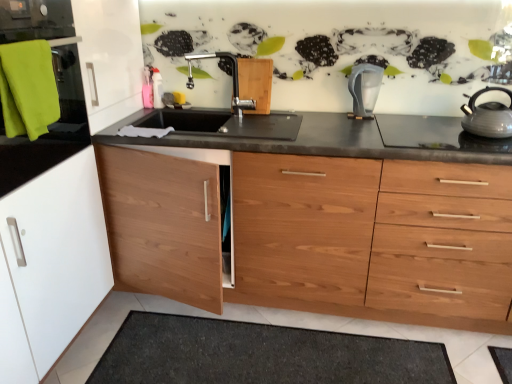
This screenshot has height=384, width=512. What do you see at coordinates (224, 124) in the screenshot?
I see `black matte sink at center` at bounding box center [224, 124].

Find the location of a particular element. black matte sink at center is located at coordinates (224, 124).

What do you see at coordinates (435, 134) in the screenshot? I see `shiny silver gas stove at right` at bounding box center [435, 134].

Measure the distance between point (401, 123) and camera.

Point (401, 123) is 6.67 feet away from camera.

Identify the location of black matte sink at center. (224, 124).

From a real-world perspective, which is physically below, dark gray textured bath mat at lower center or shiny silver gas stove at right?

dark gray textured bath mat at lower center.

Is dark gray textured bath mat at lower center next to shiny silver gas stove at right and touching it?

There is a gap between dark gray textured bath mat at lower center and shiny silver gas stove at right.

Which of these two, dark gray textured bath mat at lower center or shiny silver gas stove at right, stands taller?

dark gray textured bath mat at lower center.

Find the location of a particular element. bath mat located underneath the shiny silver gas stove at right (from a real-world perspective) is located at coordinates (260, 355).

Which of these two, matte silver faucet at center or shiny silver gas stove at right, is smaller?

With smaller size is shiny silver gas stove at right.

Who is shorter, matte silver faucet at center or shiny silver gas stove at right?

Standing shorter between the two is shiny silver gas stove at right.

From the picture: How different are the orientations of matte silver faucet at center and shiny silver gas stove at right in degrees?

They differ by 1.05 degrees in their facing directions.

Is matte silver faucet at center located outside shiny silver gas stove at right?

matte silver faucet at center lies outside shiny silver gas stove at right's area.

Considering the relative sizes of shiny silver gas stove at right and matte silver faucet at center in the image provided, is shiny silver gas stove at right wider than matte silver faucet at center?

Indeed, shiny silver gas stove at right has a greater width compared to matte silver faucet at center.

Which point is more distant from viewer, (x=398, y=125) or (x=189, y=81)?

The point (x=189, y=81) is more distant.

From the image's perspective, does shiny silver gas stove at right appear lower than matte silver faucet at center?

Yes.

Which object is further away from the camera, black matte sink at center or matte silver faucet at center?

matte silver faucet at center is further away from the camera.

From the image's perspective, relative to matte silver faucet at center, is black matte sink at center above or below?

black matte sink at center is below matte silver faucet at center.

Is black matte sink at center smaller than matte silver faucet at center?

Incorrect, black matte sink at center is not smaller in size than matte silver faucet at center.

Can you tell me how much black matte sink at center and matte silver faucet at center differ in facing direction?

They differ by 1.05 degrees in their facing directions.

Which object is thinner, black granite countertop at center or matte silver faucet at center?

matte silver faucet at center.

Considering the sizes of objects black granite countertop at center and matte silver faucet at center in the image provided, who is smaller, black granite countertop at center or matte silver faucet at center?

Smaller between the two is matte silver faucet at center.

The image size is (512, 384). Find the location of `tap on the left side of black granite countertop at center`. tap on the left side of black granite countertop at center is located at coordinates (232, 76).

Would you say dark gray textured bath mat at lower center is outside metallic gray kettle at right?

Yes, dark gray textured bath mat at lower center is located beyond the bounds of metallic gray kettle at right.

Looking at the image, does dark gray textured bath mat at lower center seem bigger or smaller compared to metallic gray kettle at right?

Clearly, dark gray textured bath mat at lower center is larger in size than metallic gray kettle at right.

Measure the distance from dark gray textured bath mat at lower center to metallic gray kettle at right.

dark gray textured bath mat at lower center and metallic gray kettle at right are 1.19 meters apart.

Which object is positioned more to the left, dark gray textured bath mat at lower center or metallic gray kettle at right?

dark gray textured bath mat at lower center is more to the left.

Who is bigger, black matte sink at center or metallic gray kettle at right?

black matte sink at center.

Locate an element on the screen. sink on the left of metallic gray kettle at right is located at coordinates (224, 124).

Is black matte sink at center at the right side of metallic gray kettle at right?

No, black matte sink at center is not to the right of metallic gray kettle at right.

From a real-world perspective, is black matte sink at center positioned over metallic gray kettle at right based on gravity?

Incorrect, from a real-world perspective, black matte sink at center is lower than metallic gray kettle at right.

You are a GUI agent. You are given a task and a screenshot of the screen. Output one action in this format:
    pyautogui.click(x=<x>, y=<y>)
    Task: Click on the bath mat in front of the shiny silver gas stove at right
    Image resolution: width=512 pixels, height=384 pixels.
    Given the screenshot: What is the action you would take?
    pyautogui.click(x=260, y=355)

Where is `tap positioned vertically above the shiny silver gas stove at right (from a real-world perspective)`? Image resolution: width=512 pixels, height=384 pixels. tap positioned vertically above the shiny silver gas stove at right (from a real-world perspective) is located at coordinates (232, 76).

Estimate the real-world distances between objects in this image. Which object is further from metallic gray kettle at right, matte silver faucet at center or dark gray textured bath mat at lower center?

dark gray textured bath mat at lower center.

From the image, which object appears to be nearer to dark gray textured bath mat at lower center, black granite countertop at center or matte silver faucet at center?

black granite countertop at center is closer to dark gray textured bath mat at lower center.

Considering their positions, is transparent plastic water filter at center positioned further to matte silver faucet at center than black granite countertop at center?

black granite countertop at center is further to matte silver faucet at center.

Considering their positions, is metallic gray kettle at right positioned further to black matte sink at center than matte silver faucet at center?

metallic gray kettle at right is further to black matte sink at center.

Based on the photo, based on their spatial positions, is transparent plastic water filter at center or shiny silver gas stove at right closer to metallic gray kettle at right?

shiny silver gas stove at right lies closer to metallic gray kettle at right than the other object.

Looking at the image, which one is located further to transparent plastic water filter at center, shiny silver gas stove at right or black matte sink at center?

Based on the image, black matte sink at center appears to be further to transparent plastic water filter at center.

Which object lies nearer to the anchor point metallic gray kettle at right, shiny silver gas stove at right or matte silver faucet at center?

shiny silver gas stove at right lies closer to metallic gray kettle at right than the other object.

When comparing their distances from black granite countertop at center, does metallic gray kettle at right or transparent plastic water filter at center seem further?

transparent plastic water filter at center is further to black granite countertop at center.

I want to click on tap between black matte sink at center and shiny silver gas stove at right in the horizontal direction, so click(x=232, y=76).

This screenshot has height=384, width=512. Find the location of `gas stove that lies between black matte sink at center and dark gray textured bath mat at lower center from top to bottom`. gas stove that lies between black matte sink at center and dark gray textured bath mat at lower center from top to bottom is located at coordinates (435, 134).

The image size is (512, 384). I want to click on kitchen appliance located between matte silver faucet at center and metallic gray kettle at right in the left-right direction, so click(x=364, y=89).

This screenshot has height=384, width=512. In order to click on countertop between shiny silver gas stove at right and dark gray textured bath mat at lower center from top to bottom in this screenshot , I will do `click(368, 228)`.